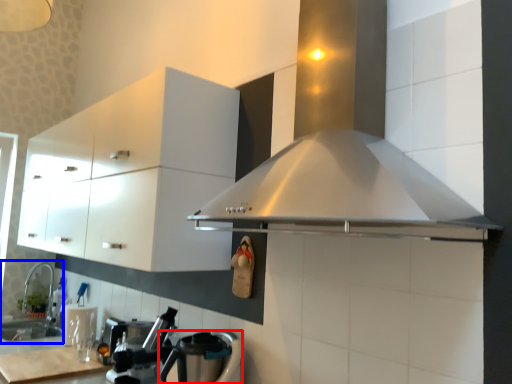
Question: Which of the following is the closest to the observer, kitchen appliance (highlighted by a red box) or sink (highlighted by a blue box)?

Choices:
 (A) kitchen appliance
 (B) sink

Answer: (A)